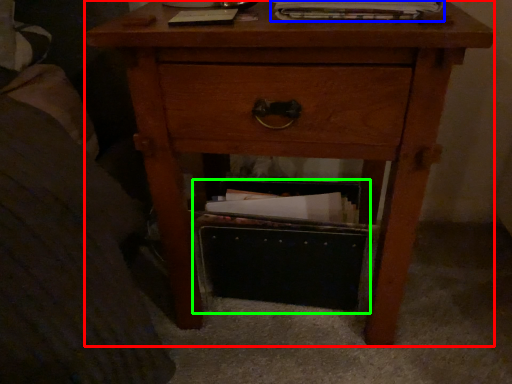
Question: Which object is positioned farthest from nightstand (highlighted by a red box)? Select from magazine (highlighted by a blue box) and shoe box (highlighted by a green box).

Choices:
 (A) magazine
 (B) shoe box

Answer: (A)